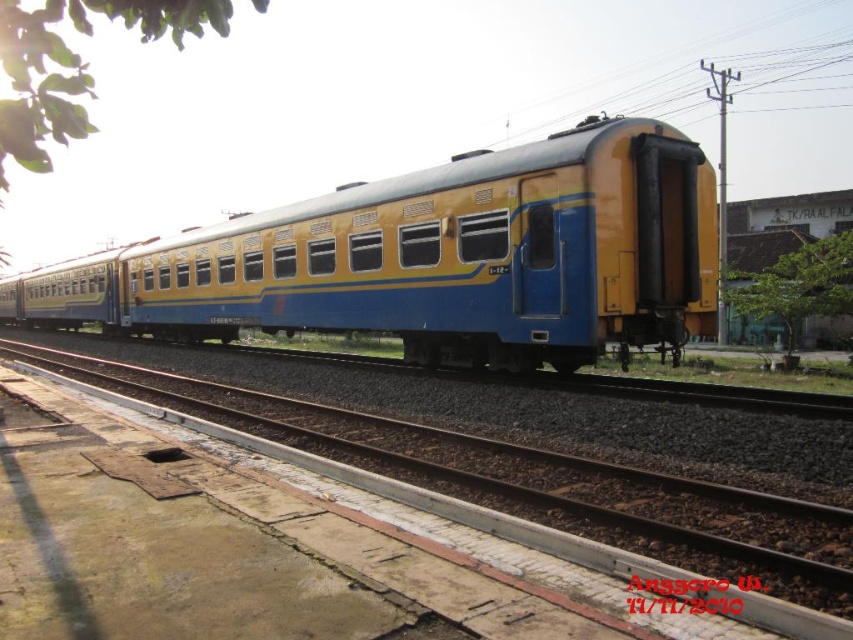
Question: Is yellow matte train car at center wider than brown gravel track at center?

Choices:
 (A) no
 (B) yes

Answer: (B)

Question: Can you confirm if yellow matte train car at center is positioned above brown gravel track at center?

Choices:
 (A) no
 (B) yes

Answer: (B)

Question: Which point is closer to the camera?

Choices:
 (A) brown gravel track at center
 (B) green leafy tree at upper left

Answer: (B)

Question: Can you confirm if green leafy tree at upper left is positioned below green leafy tree at right?

Choices:
 (A) yes
 (B) no

Answer: (B)

Question: Estimate the real-world distances between objects in this image. Which object is closer to the yellow matte train car at center?

Choices:
 (A) green leafy tree at right
 (B) green leafy tree at upper left

Answer: (B)

Question: Which object is closer to the camera taking this photo?

Choices:
 (A) green leafy tree at upper left
 (B) yellow matte train car at center
 (C) green leafy tree at right
 (D) brown gravel track at center

Answer: (A)